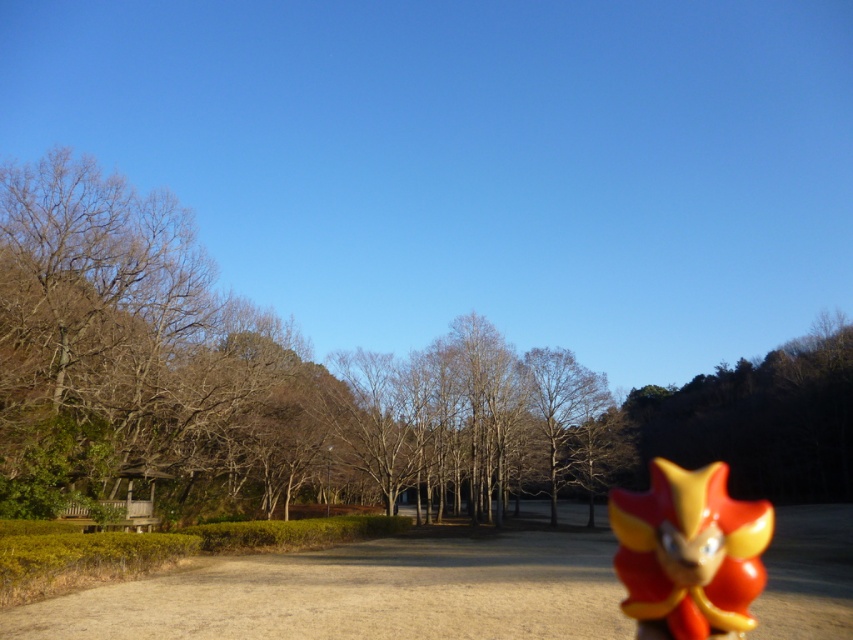
You are standing in the outdoor scene and want to take a photo of the brown leafless trees at center. Based on their position, where should you aim your camera to capture them clearly?

The brown leafless trees at center are located at point (248, 381), so you should aim your camera towards that coordinate to capture them clearly.